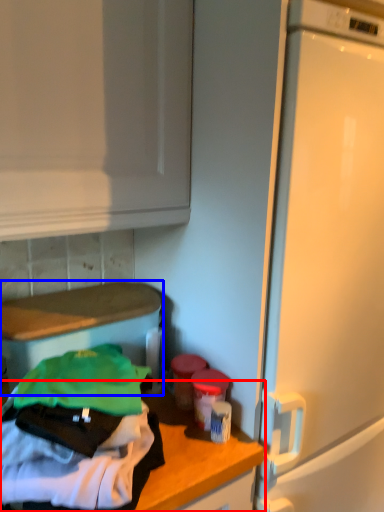
Question: Which of the following is the farthest to the observer, countertop (highlighted by a red box) or appliance (highlighted by a blue box)?

Choices:
 (A) countertop
 (B) appliance

Answer: (B)